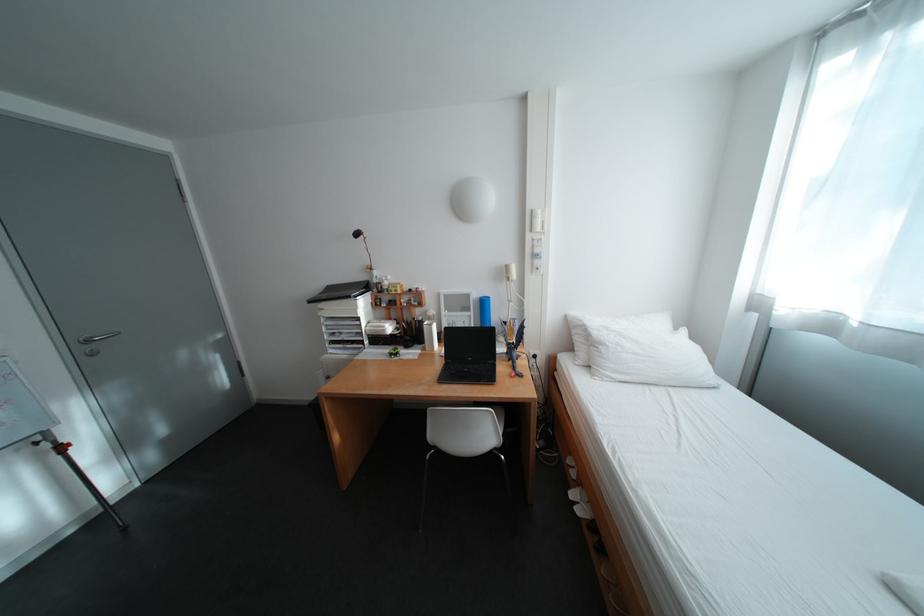
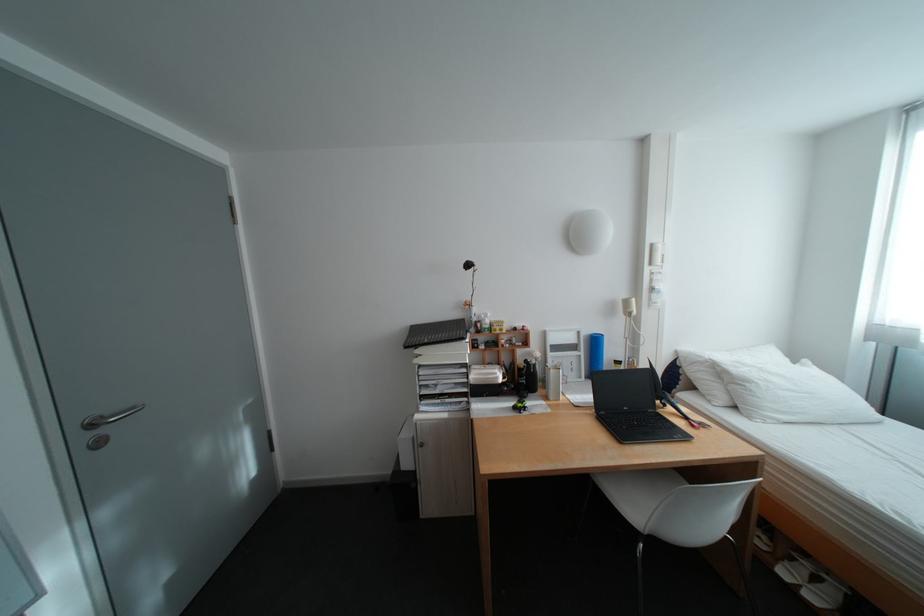
Where in the second image is the point corresponding to pixel 591 504 from the first image?

(813, 586)